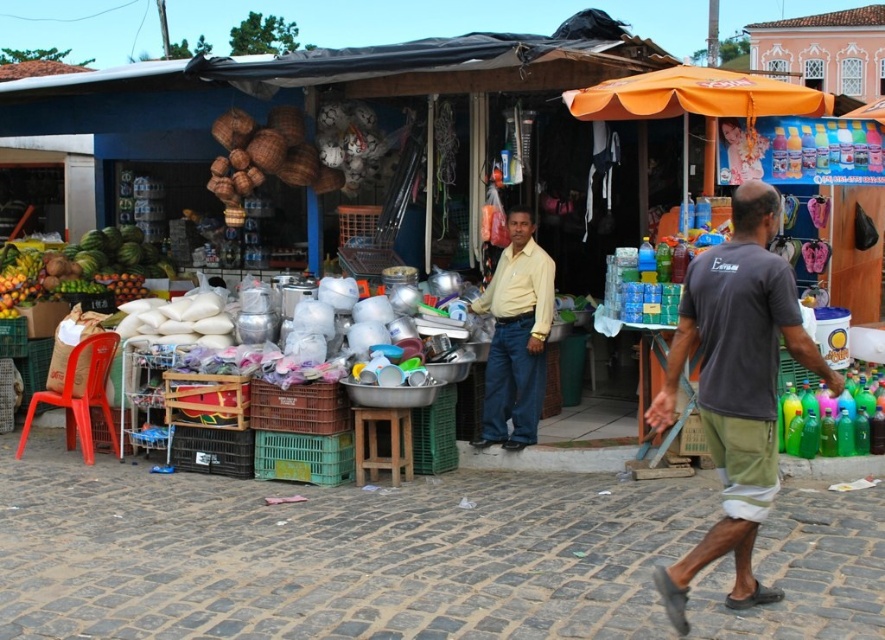
Question: Does dark gray t-shirt at center have a larger size compared to shiny green watermelon at left?

Choices:
 (A) no
 (B) yes

Answer: (A)

Question: Where is yellow matte shirt at center located in relation to shiny green watermelon at left in the image?

Choices:
 (A) right
 (B) left

Answer: (A)

Question: Among these points, which one is farthest from the camera?

Choices:
 (A) (840, 380)
 (B) (48, 272)
 (C) (529, 342)

Answer: (B)

Question: Which object is the farthest from the yellow matte shirt at center?

Choices:
 (A) dark gray t-shirt at center
 (B) shiny green watermelon at left

Answer: (B)

Question: Estimate the real-world distances between objects in this image. Which object is farther from the dark gray t-shirt at center?

Choices:
 (A) shiny green watermelon at left
 (B) yellow matte shirt at center

Answer: (A)

Question: Does yellow matte shirt at center lie in front of shiny green watermelon at left?

Choices:
 (A) yes
 (B) no

Answer: (A)